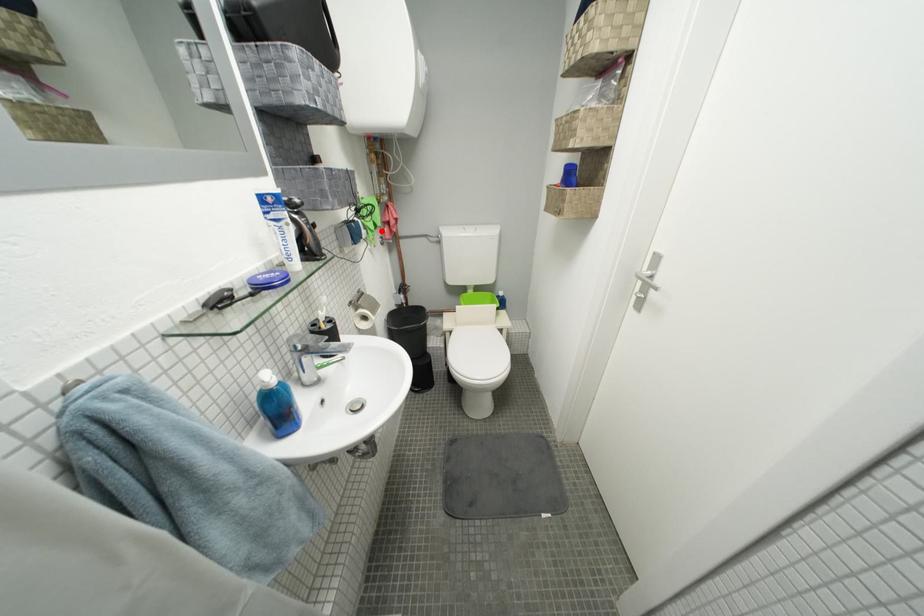
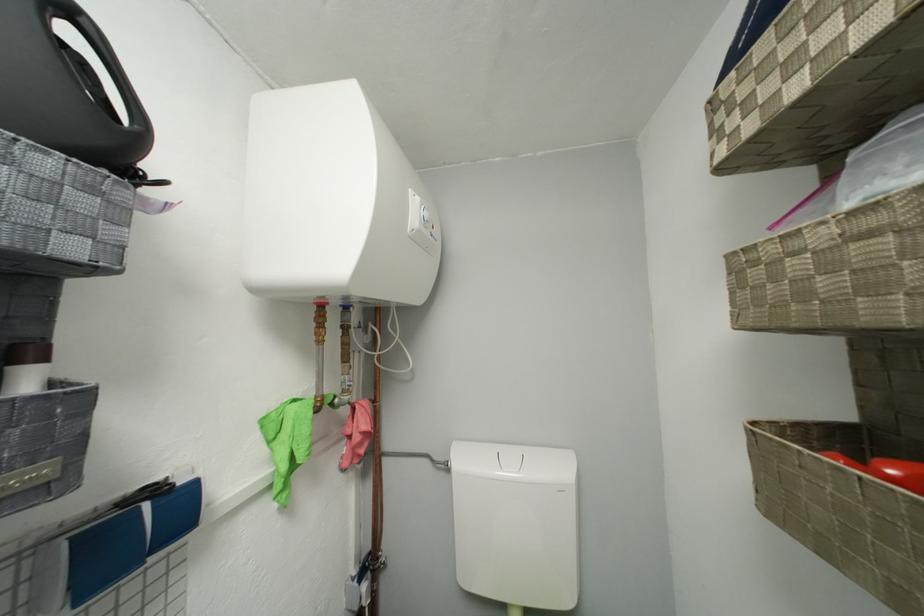
Question: I am providing you with two images of the same scene from different viewpoints. A red point is marked on the first image. Can you still see the location of the red point in image 2?

Choices:
 (A) Yes
 (B) No

Answer: (A)